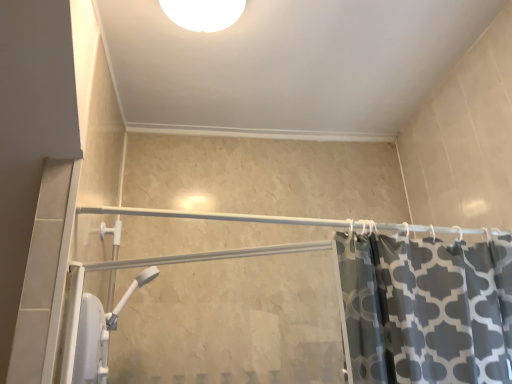
In order to face white matte light fixture at upper center, should I rotate leftwards or rightwards?

To face it directly, rotate left by 7.507 degrees.

What do you see at coordinates (203, 13) in the screenshot? I see `white matte light fixture at upper center` at bounding box center [203, 13].

The width and height of the screenshot is (512, 384). Identify the location of white matte light fixture at upper center. click(x=203, y=13).

Locate an element on the screen. This screenshot has height=384, width=512. white matte light fixture at upper center is located at coordinates (203, 13).